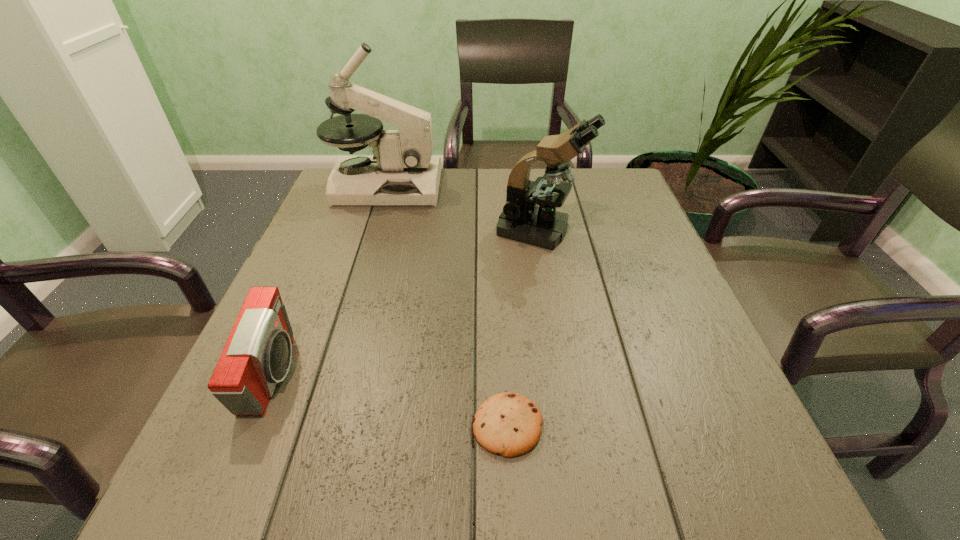
Locate an element on the screen. This screenshot has width=960, height=540. vacant region that satisfies the following two spatial constraints: 1. at the eyepiece of the left microscope; 2. on the left side of the second farthest object is located at coordinates (372, 230).

Locate an element on the screen. Image resolution: width=960 pixels, height=540 pixels. vacant space that satisfies the following two spatial constraints: 1. at the eyepiece of the taller microscope; 2. on the left side of the shortest object is located at coordinates (312, 426).